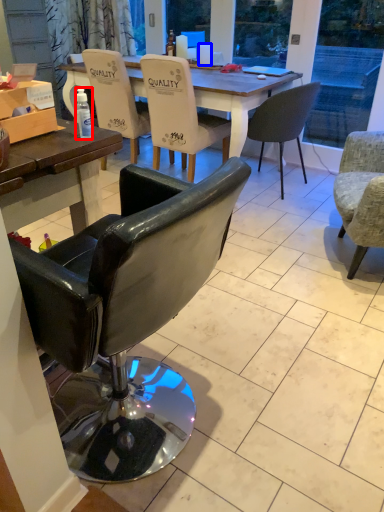
Question: Which of the following is the closest to the observer, bottle (highlighted by a red box) or coffee cup (highlighted by a blue box)?

Choices:
 (A) bottle
 (B) coffee cup

Answer: (A)